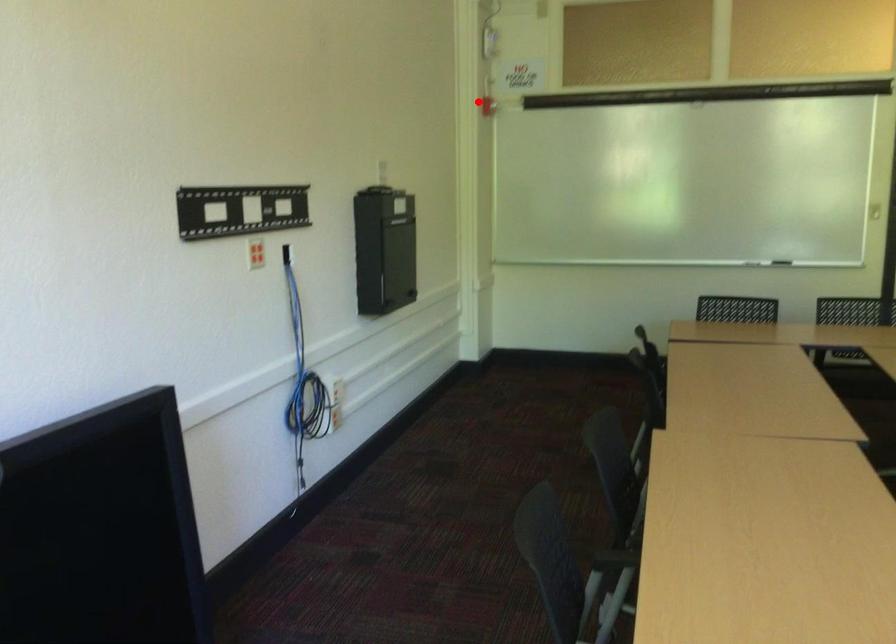
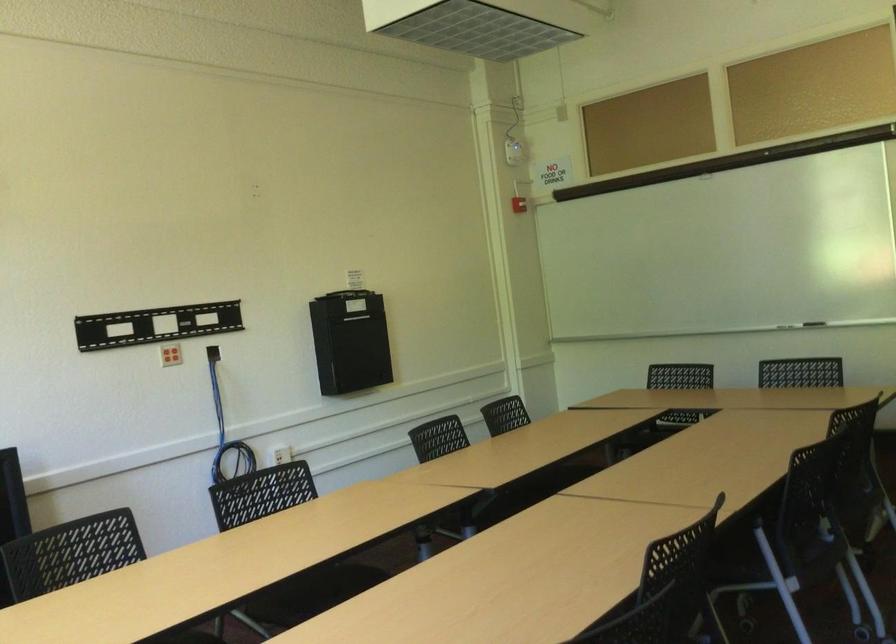
In the second image, find the point that corresponds to the highlighted location in the first image.

(519, 204)